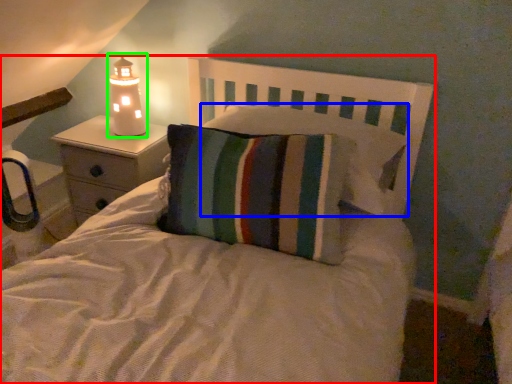
Question: Based on their relative distances, which object is farther from bed (highlighted by a red box)? Choose from pillow (highlighted by a blue box) and lamp (highlighted by a green box).

Choices:
 (A) pillow
 (B) lamp

Answer: (B)